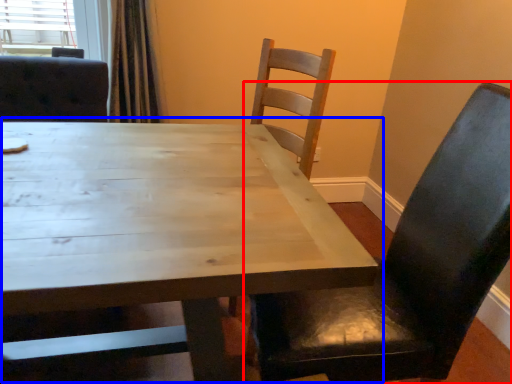
Question: Which point is closer to the camera, chair (highlighted by a red box) or table (highlighted by a blue box)?

Choices:
 (A) chair
 (B) table

Answer: (B)